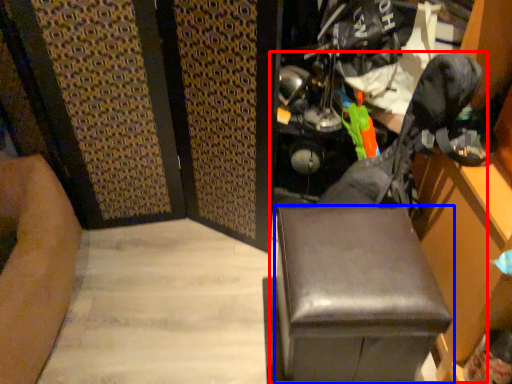
Question: Which point is further to the camera, swivel chair (highlighted by a red box) or furniture (highlighted by a blue box)?

Choices:
 (A) swivel chair
 (B) furniture

Answer: (B)